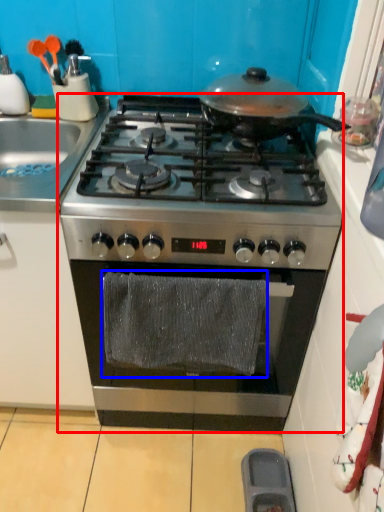
Question: Which object is further to the camera taking this photo, gas stove (highlighted by a red box) or material (highlighted by a blue box)?

Choices:
 (A) gas stove
 (B) material

Answer: (A)